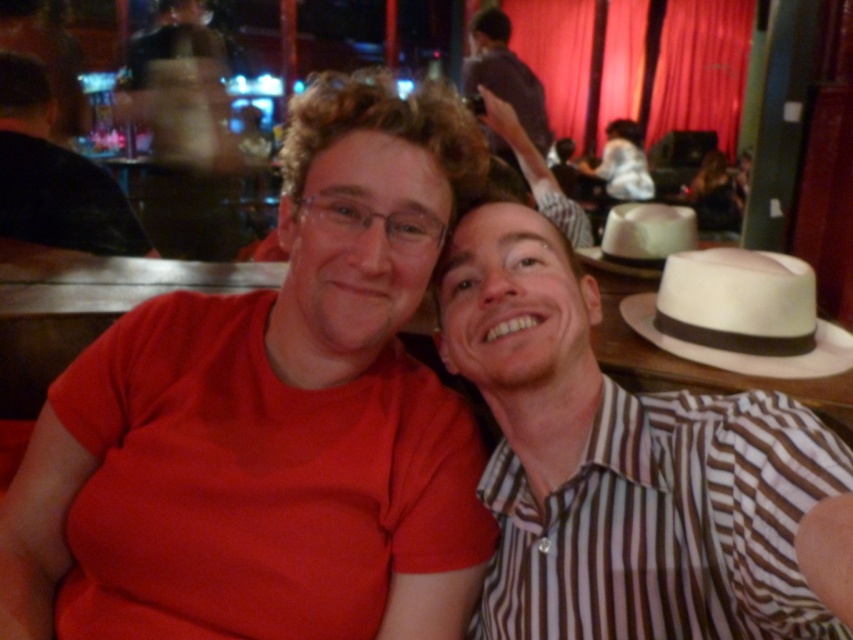
You are a photographer setting up for a group photo. You notice the striped cotton shirt at right and the white felt cowboy hat at upper right. Which object is positioned lower in the image?

The striped cotton shirt at right is positioned below the white felt cowboy hat at upper right, so the striped cotton shirt at right is lower in the image.

You are a photographer setting up for a group photo. You need to ensure that all subjects are visible. Given the striped cotton shirt at right and the white felt cowboy hat at upper right, which one might block the view of the other if positioned too closely?

The striped cotton shirt at right is taller than the white felt cowboy hat at upper right, so it could potentially block the view of the hat if positioned too closely.